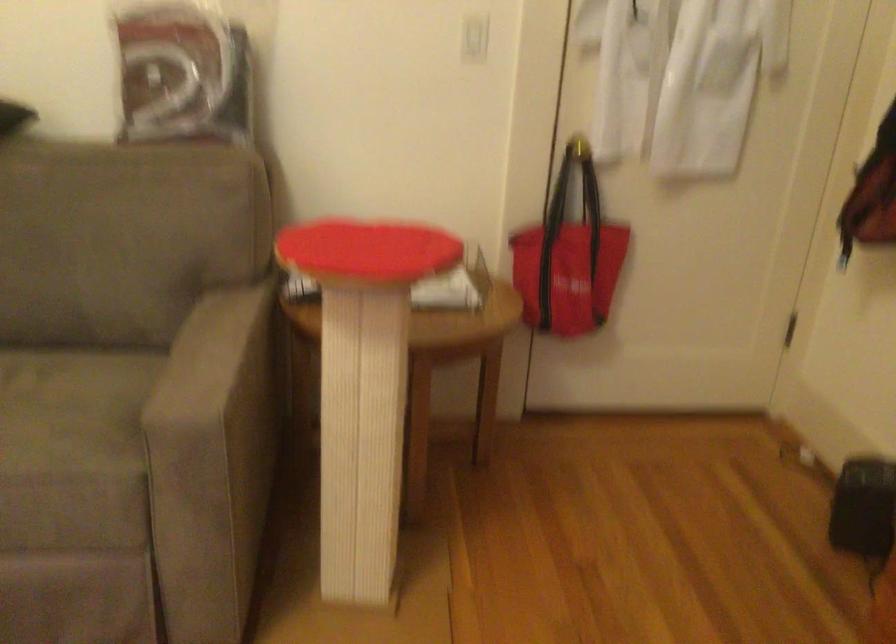
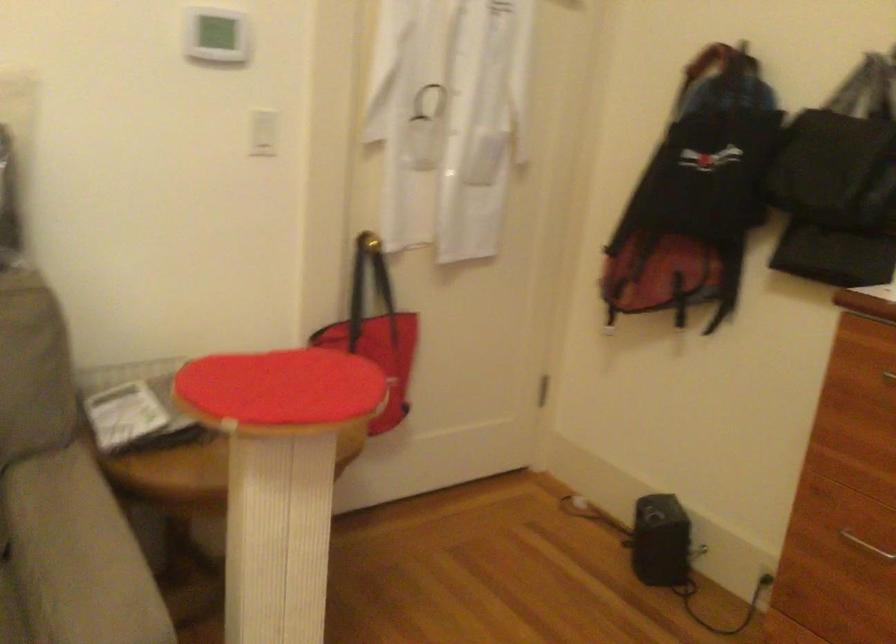
Question: Which direction would the cameraman need to move to produce the second image? Reply with the corresponding letter.

Choices:
 (A) Left
 (B) Right
 (C) Forward
 (D) Backward

Answer: (A)